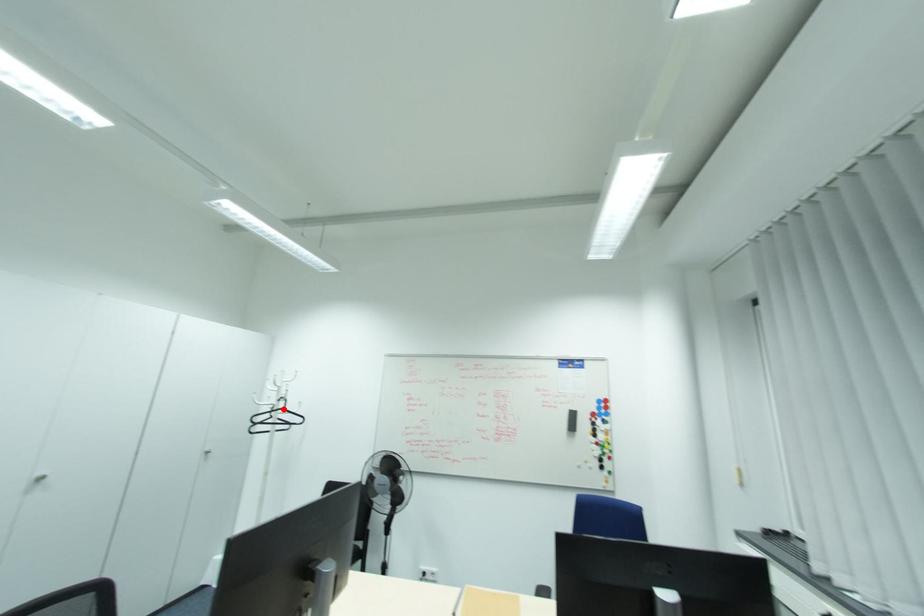
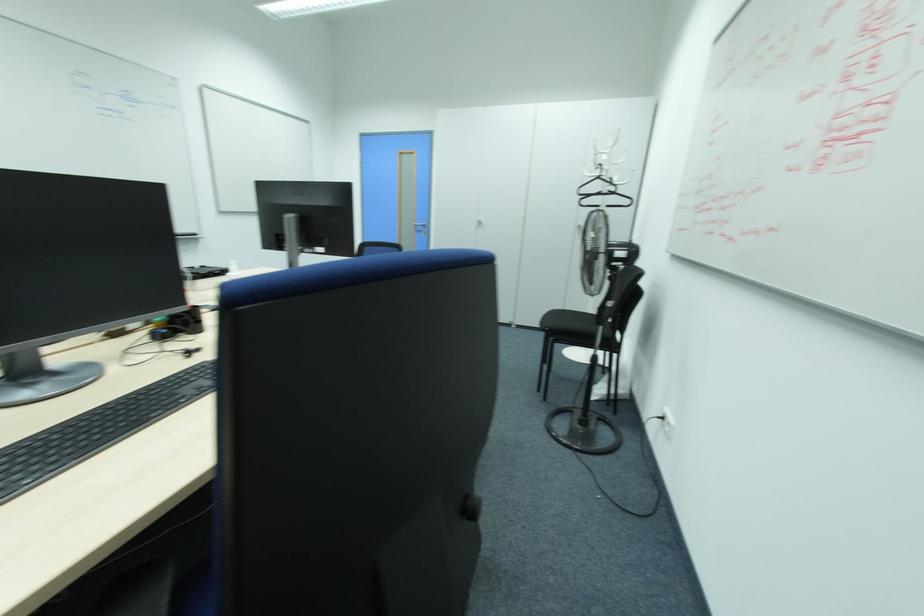
Where in the second image is the point corresponding to the highlighted location from the first image?

(599, 177)